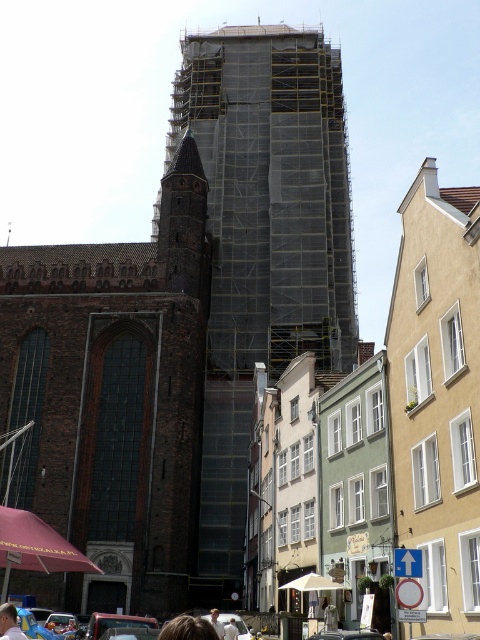
You are standing in the middle of the street looking at the brown stone church at left and the light blue shirt at lower left. Which object is closer to you?

The light blue shirt at lower left is behind the brown stone church at left, so the brown stone church at left is closer to you.

You are a photographer standing in the middle of the scene. You want to take a photo that includes both the brown stone church at left and the light brown hair at lower center. Which object should you adjust your camera angle to focus on first to ensure both are in the frame?

The brown stone church at left is located above the light brown hair at lower center, so you should adjust your camera angle to focus on the brown stone church at left first to ensure both are in the frame.

You are a city planner assessing the urban layout. Given the brown stone church at left and the light brown hair at lower center, which object occupies more horizontal space in the scene?

The brown stone church at left is wider than the light brown hair at lower center, so it occupies more horizontal space.